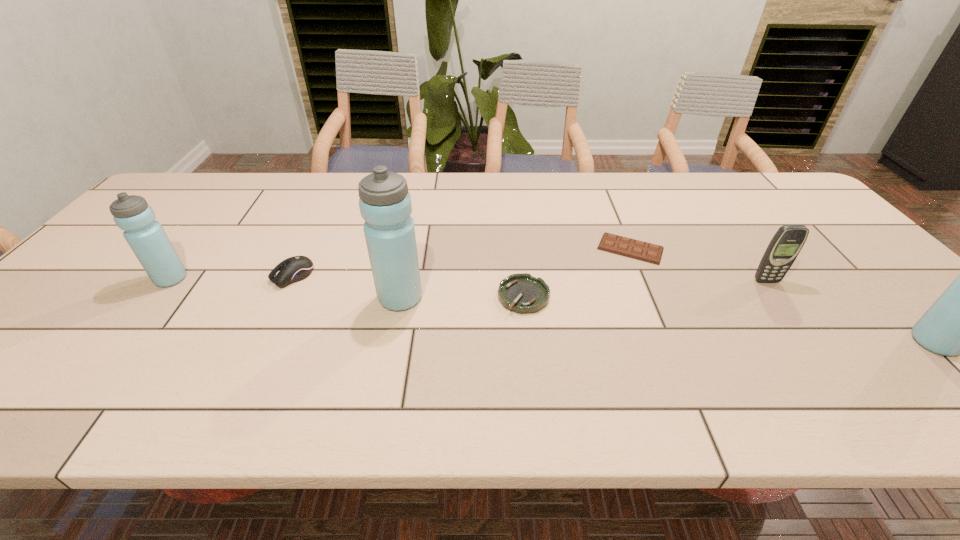
Identify which object is the second nearest to the cellular telephone. Please provide its 2D coordinates. Your answer should be formatted as a tuple, i.e. [(x, y)], where the tuple contains the x and y coordinates of a point satisfying the conditions above.

[(959, 322)]

The image size is (960, 540). What are the coordinates of `water bottle that stands as the third closest to the ashtray` in the screenshot? It's located at (146, 237).

Identify which water bottle is the second nearest to the ashtray. Please provide its 2D coordinates. Your answer should be formatted as a tuple, i.e. [(x, y)], where the tuple contains the x and y coordinates of a point satisfying the conditions above.

[(959, 322)]

Where is `free space that satisfies the following two spatial constraints: 1. on the back side of the fifth tallest object; 2. on the left side of the shortest water bottle`? free space that satisfies the following two spatial constraints: 1. on the back side of the fifth tallest object; 2. on the left side of the shortest water bottle is located at coordinates (174, 276).